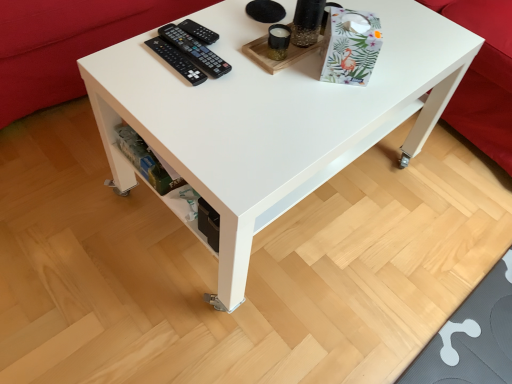
Image resolution: width=512 pixels, height=384 pixels. I want to click on vacant area located to the right-hand side of black plastic remote controls at upper left, the second control in the top-to-bottom sequence, so click(261, 63).